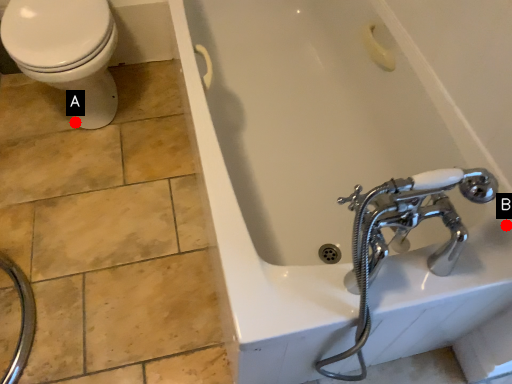
Question: Two points are circled on the image, labeled by A and B beside each circle. Which point is closer to the camera taking this photo?

Choices:
 (A) A is closer
 (B) B is closer

Answer: (B)